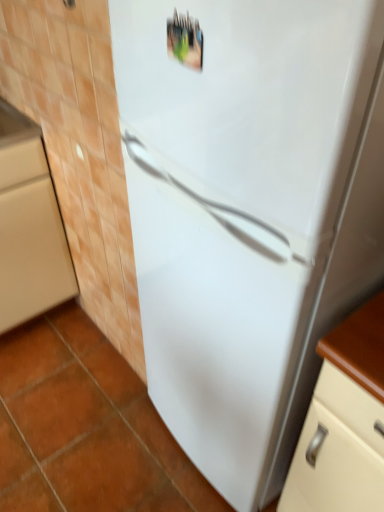
Question: Is matte wood cabinet at lower left taller or shorter than white glossy refrigerator at center?

Choices:
 (A) short
 (B) tall

Answer: (A)

Question: Would you say matte wood cabinet at lower left is inside or outside white glossy refrigerator at center?

Choices:
 (A) inside
 (B) outside

Answer: (B)

Question: Is point (41, 217) positioned closer to the camera than point (130, 31)?

Choices:
 (A) farther
 (B) closer

Answer: (A)

Question: From their relative heights in the image, would you say white glossy refrigerator at center is taller or shorter than matte wood cabinet at lower left?

Choices:
 (A) short
 (B) tall

Answer: (B)

Question: Is white glossy refrigerator at center inside or outside of matte wood cabinet at lower left?

Choices:
 (A) inside
 (B) outside

Answer: (B)

Question: In terms of size, does white glossy refrigerator at center appear bigger or smaller than matte wood cabinet at lower left?

Choices:
 (A) small
 (B) big

Answer: (B)

Question: From the image's perspective, is white glossy refrigerator at center above or below matte wood cabinet at lower left?

Choices:
 (A) below
 (B) above

Answer: (A)